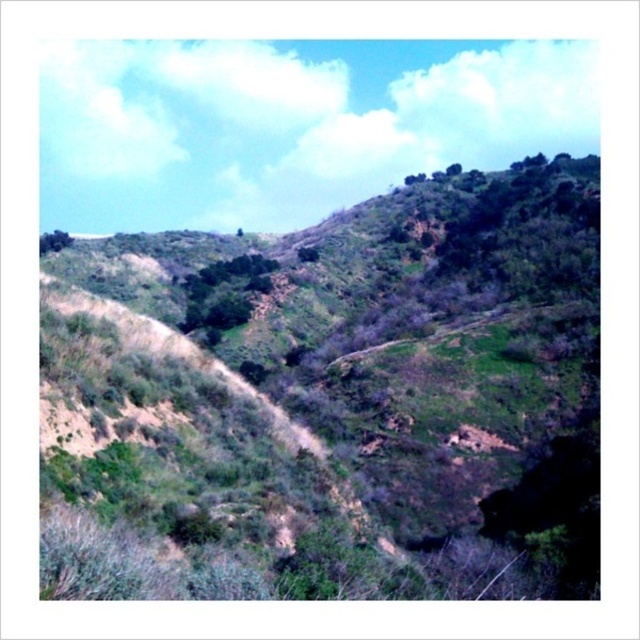
Question: Can you confirm if green grassy hillside at center is wider than green leafy tree at upper left?

Choices:
 (A) no
 (B) yes

Answer: (B)

Question: Which point is closer to the camera taking this photo?

Choices:
 (A) coord(56,243)
 (B) coord(49,310)

Answer: (B)

Question: Which point is farther to the camera?

Choices:
 (A) (550, 490)
 (B) (204, 273)

Answer: (B)

Question: Which object is farther from the camera taking this photo?

Choices:
 (A) green leafy tree at center
 (B) green grassy hillside at center

Answer: (A)

Question: Is the position of green leafy tree at center more distant than that of green leafy tree at upper left?

Choices:
 (A) yes
 (B) no

Answer: (B)

Question: Can you confirm if green leafy tree at center is positioned to the left of green leafy tree at upper left?

Choices:
 (A) no
 (B) yes

Answer: (A)